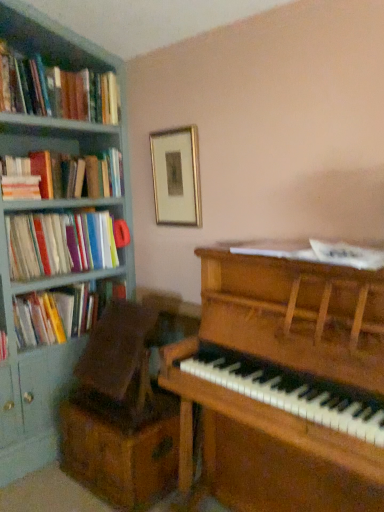
Question: Is wooden drawer at lower left bigger or smaller than hardcover book at left, the fourth book when ordered from top to bottom?

Choices:
 (A) small
 (B) big

Answer: (B)

Question: From their relative heights in the image, would you say wooden drawer at lower left is taller or shorter than hardcover book at left, the fourth book when ordered from top to bottom?

Choices:
 (A) tall
 (B) short

Answer: (A)

Question: Considering the real-world distances, which object is farthest from the wooden drawer at lower left?

Choices:
 (A) hardcover books at left, positioned as the fourth book in bottom-to-top order
 (B) hardcover book at left, the first book positioned from the bottom
 (C) hardcover books at left, marked as the 2th book in a bottom-to-top arrangement
 (D) hardcover books at left, the second book positioned from the top
 (E) gold-framed picture at upper center

Answer: (A)

Question: Estimate the real-world distances between objects in this image. Which object is closer to the gold-framed picture at upper center?

Choices:
 (A) hardcover books at left, placed as the first book when sorted from top to bottom
 (B) hardcover books at left, the second book positioned from the top
 (C) wooden piano at center
 (D) wooden drawer at lower left
 (E) hardcover books at left, marked as the 2th book in a bottom-to-top arrangement

Answer: (B)